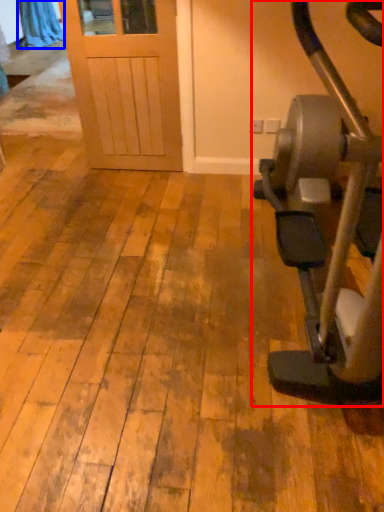
Question: Among these objects, which one is nearest to the camera, stationary bicycle (highlighted by a red box) or curtain (highlighted by a blue box)?

Choices:
 (A) stationary bicycle
 (B) curtain

Answer: (A)